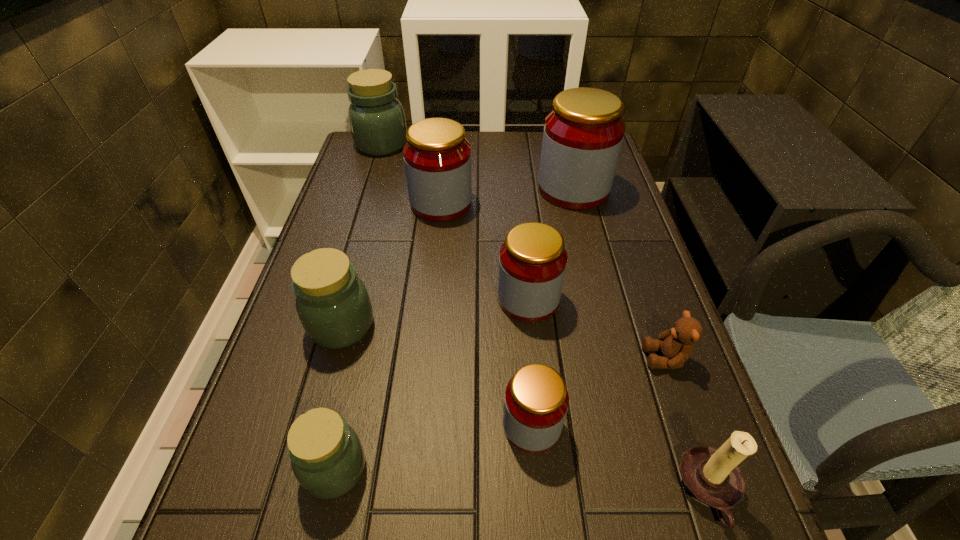
In order to click on vacant area located on the back of the nearest green jar in this screenshot , I will do `click(373, 298)`.

Find the location of a particular element. Image resolution: width=960 pixels, height=540 pixels. vacant area situated on the face of the brown teddy bear is located at coordinates (506, 358).

The image size is (960, 540). What are the coordinates of `free space located 0.070m on the face of the brown teddy bear` in the screenshot? It's located at (x=610, y=358).

Locate an element on the screen. The height and width of the screenshot is (540, 960). free space located 0.230m on the face of the brown teddy bear is located at coordinates (531, 358).

Where is `jar at the right edge`? The height and width of the screenshot is (540, 960). jar at the right edge is located at coordinates (583, 134).

At what (x,y) coordinates should I click in order to perform the action: click on candle holder situated at the right edge. Please return your answer as a coordinate pair (x, y). The image size is (960, 540). Looking at the image, I should click on (711, 476).

Identify the location of teddy bear that is at the right edge. The width and height of the screenshot is (960, 540). (676, 345).

Locate an element on the screen. The image size is (960, 540). object that is at the far left corner is located at coordinates tap(377, 122).

Identify the location of object present at the far right corner. (583, 134).

The width and height of the screenshot is (960, 540). In order to click on free space at the far edge of the desktop in this screenshot , I will do `click(501, 131)`.